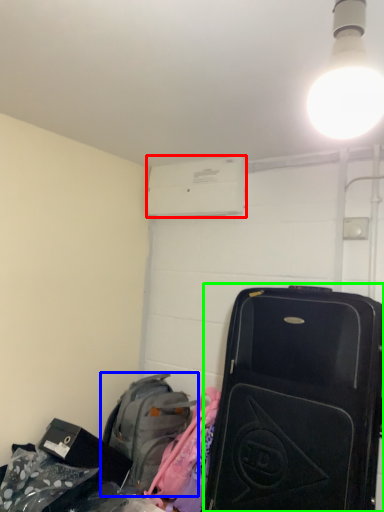
Question: Estimate the real-world distances between objects in this image. Which object is farther from air conditioning (highlighted by a red box), luggage and bags (highlighted by a blue box) or suitcase (highlighted by a green box)?

Choices:
 (A) luggage and bags
 (B) suitcase

Answer: (A)